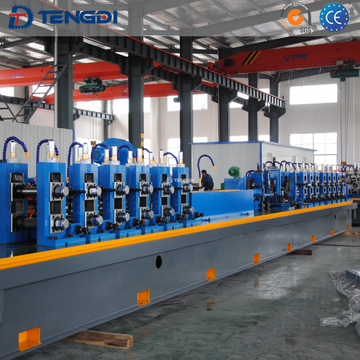
Locate an element on the screen. ladder is located at coordinates (27, 111), (12, 117).